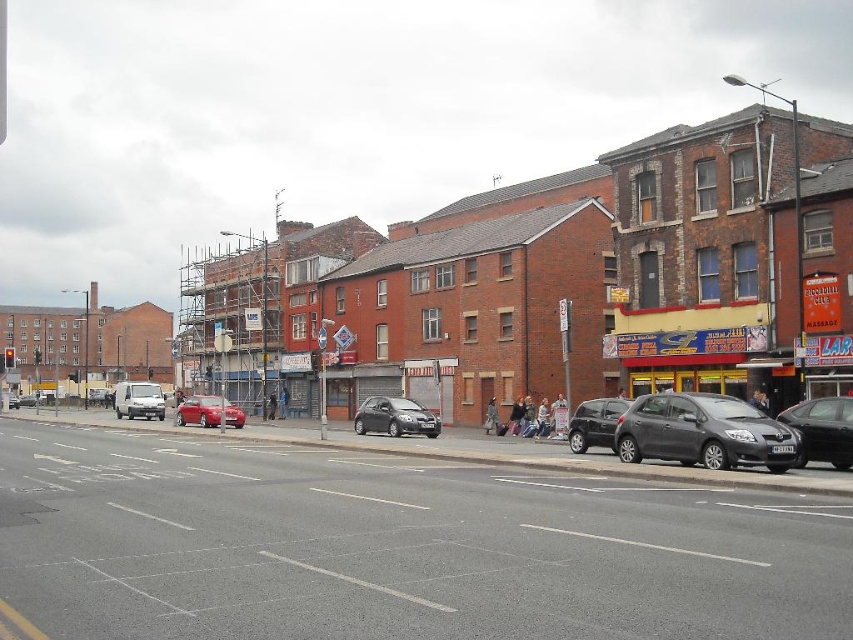
You are driving a delivery van that is 6 meters long. You want to park your van between the dark gray metallic hatchback at lower right and the metallic red car at center. Can you fit your van in the space between them without overlapping either vehicle?

The distance between the dark gray metallic hatchback at lower right and the metallic red car at center is 20.55 meters. Since your van is 6 meters long, there is sufficient space to park between them without overlapping either vehicle.

You are a delivery driver who needs to park your vehicle in a tight space. You observe the satin black car at lower right and the metallic red car at center. Which vehicle would require more space to park?

The metallic red car at center requires more space to park because the satin black car at lower right occupies less space than it.